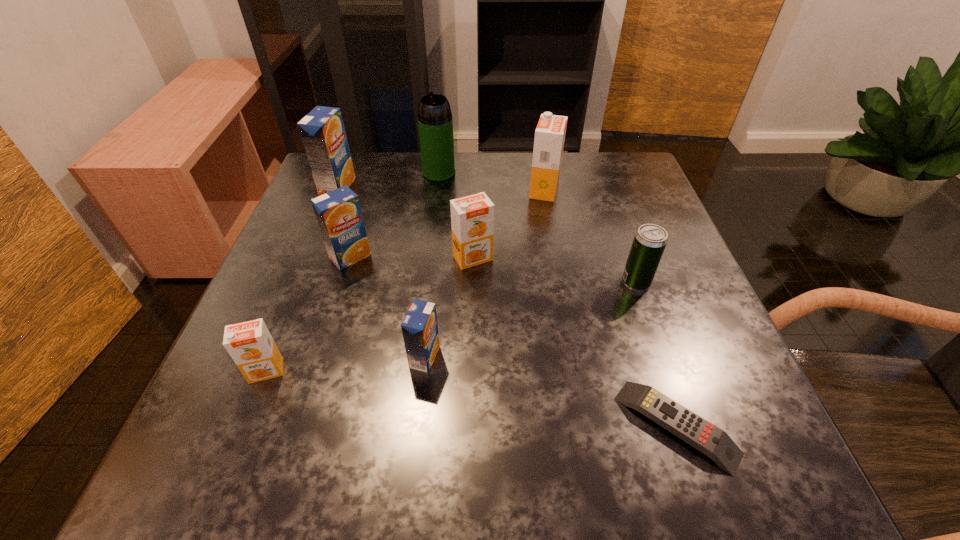
Locate an element on the screen. Image resolution: width=960 pixels, height=540 pixels. free spot that satisfies the following two spatial constraints: 1. from the spout of the beer can; 2. on the left side of the tallest object is located at coordinates (426, 282).